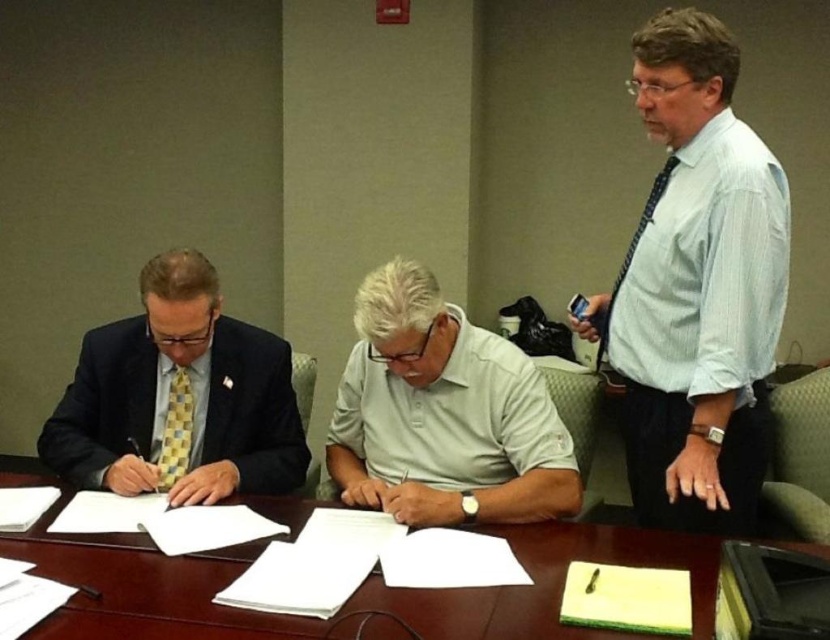
Does white striped shirt at right have a greater width compared to brown wooden table at center?

In fact, white striped shirt at right might be narrower than brown wooden table at center.

Does white striped shirt at right have a smaller size compared to brown wooden table at center?

No, white striped shirt at right is not smaller than brown wooden table at center.

Is point (650, 67) positioned behind point (83, 577)?

That is True.

This screenshot has width=830, height=640. In order to click on white striped shirt at right in this screenshot , I will do `click(697, 289)`.

Does white striped shirt at right have a greater height compared to matte yellow tie at left?

Yes.

Is white striped shirt at right wider than matte yellow tie at left?

In fact, white striped shirt at right might be narrower than matte yellow tie at left.

At what (x,y) coordinates should I click in order to perform the action: click on white striped shirt at right. Please return your answer as a coordinate pair (x, y). Looking at the image, I should click on click(697, 289).

This screenshot has width=830, height=640. In order to click on white striped shirt at right in this screenshot , I will do `click(697, 289)`.

Is white striped shirt at right smaller than blue dotted tie at right?

Incorrect, white striped shirt at right is not smaller in size than blue dotted tie at right.

Does point (687, 67) come farther from viewer compared to point (672, 157)?

No, it is not.

Find the location of a particular element. This screenshot has width=830, height=640. white striped shirt at right is located at coordinates (697, 289).